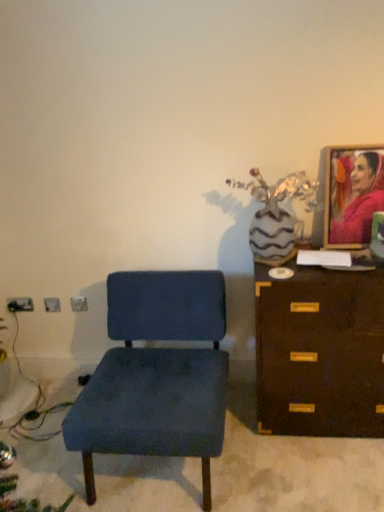
The height and width of the screenshot is (512, 384). In order to click on matte pink fabric portrait at upper right in this screenshot , I will do `click(361, 201)`.

Considering the sizes of brown wooden chest of drawers at right and velvet blue chair at center in the image, is brown wooden chest of drawers at right bigger or smaller than velvet blue chair at center?

Considering their sizes, brown wooden chest of drawers at right takes up less space than velvet blue chair at center.

Is brown wooden chest of drawers at right positioned with its back to velvet blue chair at center?

brown wooden chest of drawers at right does not have its back to velvet blue chair at center.

Which is correct: brown wooden chest of drawers at right is inside velvet blue chair at center, or outside of it?

brown wooden chest of drawers at right is not inside velvet blue chair at center, it's outside.

Find the location of a particular element. The image size is (384, 512). chair in front of the brown wooden chest of drawers at right is located at coordinates (156, 374).

From a real-world perspective, which object stands above the other?

From a 3D spatial view, brown wooden chest of drawers at right is above.

Which of these two, velvet blue chair at center or brown wooden chest of drawers at right, is bigger?

With larger size is velvet blue chair at center.

How many degrees apart are the facing directions of velvet blue chair at center and brown wooden chest of drawers at right?

The angle between the facing direction of velvet blue chair at center and the facing direction of brown wooden chest of drawers at right is 0.74 degrees.

From the image's perspective, is velvet blue chair at center above brown wooden chest of drawers at right?

No.

Is brown wooden chest of drawers at right turned away from matte pink fabric portrait at upper right?

No, brown wooden chest of drawers at right is not facing the opposite direction of matte pink fabric portrait at upper right.

From a real-world perspective, is brown wooden chest of drawers at right on top of matte pink fabric portrait at upper right?

No, from a real-world perspective, brown wooden chest of drawers at right is not on top of matte pink fabric portrait at upper right.

This screenshot has width=384, height=512. Find the location of `person to the right of brown wooden chest of drawers at right`. person to the right of brown wooden chest of drawers at right is located at coordinates click(361, 201).

Which is less distant, (150, 329) or (360, 160)?

Point (150, 329) is farther from the camera than point (360, 160).

Which is behind, velvet blue chair at center or matte pink fabric portrait at upper right?

Positioned behind is matte pink fabric portrait at upper right.

From the image's perspective, is velvet blue chair at center above or below matte pink fabric portrait at upper right?

From the image's perspective, velvet blue chair at center appears below matte pink fabric portrait at upper right.

Does velvet blue chair at center have a lesser width compared to matte pink fabric portrait at upper right?

No, velvet blue chair at center is not thinner than matte pink fabric portrait at upper right.

Considering the positions of objects matte pink fabric portrait at upper right and brown wooden chest of drawers at right in the image provided, who is in front, matte pink fabric portrait at upper right or brown wooden chest of drawers at right?

brown wooden chest of drawers at right is in front.

Is matte pink fabric portrait at upper right outside of brown wooden chest of drawers at right?

Indeed, matte pink fabric portrait at upper right is completely outside brown wooden chest of drawers at right.

From a real-world perspective, relative to brown wooden chest of drawers at right, is matte pink fabric portrait at upper right vertically above or below?

In terms of real-world spatial position, matte pink fabric portrait at upper right is above brown wooden chest of drawers at right.

Would you say matte pink fabric portrait at upper right is a long distance from brown wooden chest of drawers at right?

No.

Which of these two, matte pink fabric portrait at upper right or velvet blue chair at center, is smaller?

With smaller size is matte pink fabric portrait at upper right.

Which is behind, matte pink fabric portrait at upper right or velvet blue chair at center?

Positioned behind is matte pink fabric portrait at upper right.

From a real-world perspective, who is located higher, matte pink fabric portrait at upper right or velvet blue chair at center?

matte pink fabric portrait at upper right, from a real-world perspective.

Can you tell me how much matte pink fabric portrait at upper right and velvet blue chair at center differ in facing direction?

The angular difference between matte pink fabric portrait at upper right and velvet blue chair at center is 0.44 degrees.

Locate an element on the screen. This screenshot has height=512, width=384. the chest of drawers that appears above the velvet blue chair at center (from the image's perspective) is located at coordinates (320, 352).

Locate an element on the screen. chair lying on the left of brown wooden chest of drawers at right is located at coordinates (156, 374).

Which object lies nearer to the anchor point matte pink fabric portrait at upper right, velvet blue chair at center or brown wooden chest of drawers at right?

Based on the image, brown wooden chest of drawers at right appears to be nearer to matte pink fabric portrait at upper right.

When comparing their distances from brown wooden chest of drawers at right, does velvet blue chair at center or matte pink fabric portrait at upper right seem closer?

The object closer to brown wooden chest of drawers at right is velvet blue chair at center.

From the image, which object appears to be nearer to brown wooden chest of drawers at right, matte pink fabric portrait at upper right or velvet blue chair at center?

velvet blue chair at center lies closer to brown wooden chest of drawers at right than the other object.

Based on their spatial positions, is brown wooden chest of drawers at right or matte pink fabric portrait at upper right closer to velvet blue chair at center?

brown wooden chest of drawers at right is closer to velvet blue chair at center.

Based on the photo, estimate the real-world distances between objects in this image. Which object is further from matte pink fabric portrait at upper right, brown wooden chest of drawers at right or velvet blue chair at center?

The object further to matte pink fabric portrait at upper right is velvet blue chair at center.

When comparing their distances from velvet blue chair at center, does matte pink fabric portrait at upper right or brown wooden chest of drawers at right seem further?

matte pink fabric portrait at upper right is positioned further to the anchor velvet blue chair at center.

Identify the location of chest of drawers between velvet blue chair at center and matte pink fabric portrait at upper right. (320, 352).